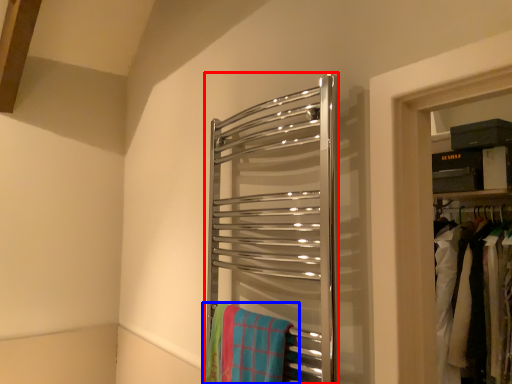
Question: Among these objects, which one is nearest to the camera, towel rack (highlighted by a red box) or beach towel (highlighted by a blue box)?

Choices:
 (A) towel rack
 (B) beach towel

Answer: (A)